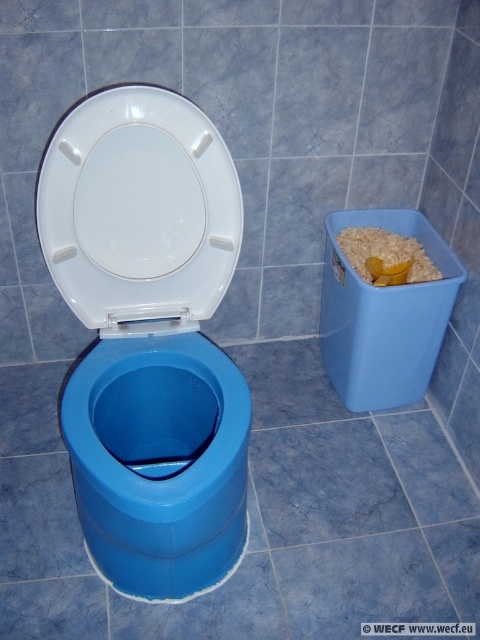
Does point (90, 492) come farther from viewer compared to point (180, 186)?

No, it is in front of (180, 186).

Who is more forward, (237, 433) or (128, 100)?

Point (237, 433) is in front.

Describe the element at coordinates (158, 461) in the screenshot. I see `blue plastic toilet bowl at center` at that location.

Image resolution: width=480 pixels, height=640 pixels. Find the location of `blue plastic toilet bowl at center`. blue plastic toilet bowl at center is located at coordinates (158, 461).

Is white glossy toilet seat at center bigger than yellow plastic scoop at right?

Yes, white glossy toilet seat at center is bigger than yellow plastic scoop at right.

Describe the element at coordinates (139, 209) in the screenshot. I see `white glossy toilet seat at center` at that location.

Is point (235, 216) closer to viewer compared to point (408, 250)?

Yes.

At what (x,y) coordinates should I click in order to perform the action: click on white glossy toilet seat at center. Please return your answer as a coordinate pair (x, y). The height and width of the screenshot is (640, 480). Looking at the image, I should click on (139, 209).

Measure the distance between point (197,515) and camera.

The distance of point (197,515) from camera is 3.60 feet.

Does blue plastic toilet bowl at center have a larger size compared to yellow plastic scoop at right?

Yes, blue plastic toilet bowl at center is bigger than yellow plastic scoop at right.

Does point (164, 344) come farther from viewer compared to point (420, 260)?

No, it is not.

At what (x,y) coordinates should I click in order to perform the action: click on blue plastic toilet bowl at center. Please return your answer as a coordinate pair (x, y). Looking at the image, I should click on (x=158, y=461).